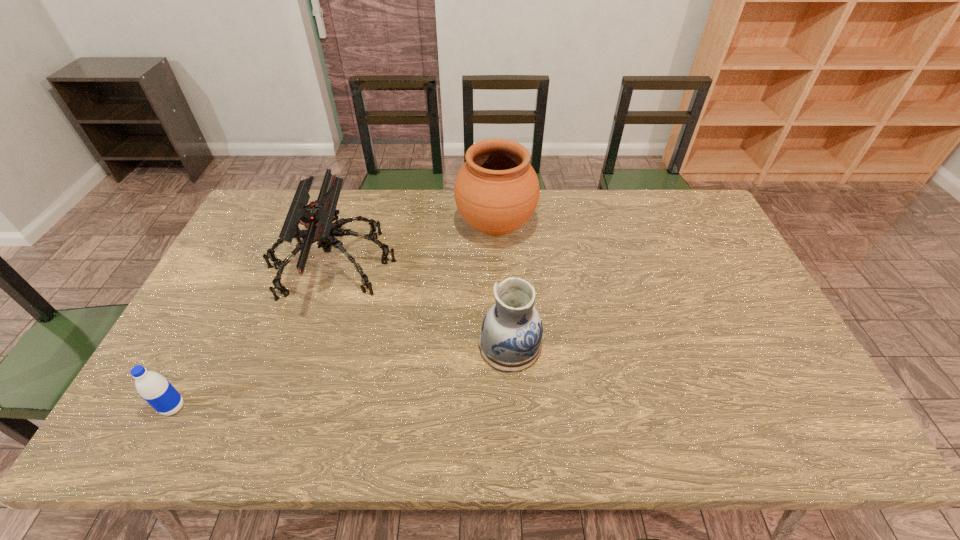
You are a GUI agent. You are given a task and a screenshot of the screen. Output one action in this format:
    pyautogui.click(x=<x>, y=<y>)
    Task: Click on the drone that is at the far edge
    The width and height of the screenshot is (960, 540).
    Given the screenshot: What is the action you would take?
    pyautogui.click(x=317, y=217)

The width and height of the screenshot is (960, 540). In order to click on object situated at the near edge in this screenshot , I will do `click(153, 387)`.

Where is `drone present at the left edge`? Image resolution: width=960 pixels, height=540 pixels. drone present at the left edge is located at coordinates (317, 217).

Find the location of a particular element. water bottle present at the left edge is located at coordinates (153, 387).

I want to click on object that is positioned at the far left corner, so click(317, 217).

Find the location of `object that is at the near left corner`. object that is at the near left corner is located at coordinates (153, 387).

In the image, there is a desktop. Identify the location of vacant space at the far edge. This screenshot has width=960, height=540. (621, 191).

Image resolution: width=960 pixels, height=540 pixels. In the image, there is a desktop. Find the location of `free region at the near edge`. free region at the near edge is located at coordinates (440, 442).

You are a GUI agent. You are given a task and a screenshot of the screen. Output one action in this format:
    pyautogui.click(x=<x>, y=<y>)
    Task: Click on the free point at the right edge
    The image size is (960, 540).
    Given the screenshot: What is the action you would take?
    pyautogui.click(x=732, y=336)

In the image, there is a desktop. Identify the location of vacant space at the far right corner. (675, 191).